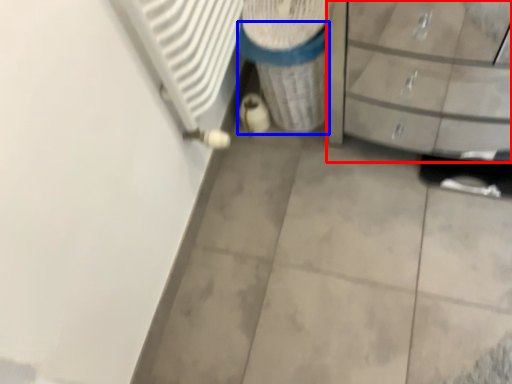
Question: Which of the following is the farthest to the observer, chest of drawers (highlighted by a red box) or recycling bin (highlighted by a blue box)?

Choices:
 (A) chest of drawers
 (B) recycling bin

Answer: (B)